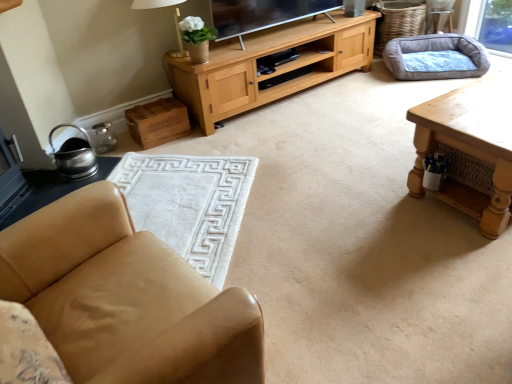
Question: Is brushed metal side table at lower left taller or shorter than white soft rug at lower left?

Choices:
 (A) short
 (B) tall

Answer: (A)

Question: Considering the positions of point (45, 193) and point (190, 236), is point (45, 193) closer or farther from the camera than point (190, 236)?

Choices:
 (A) farther
 (B) closer

Answer: (A)

Question: Which is nearer to the white fabric lampshade at upper center?

Choices:
 (A) wooden table at right
 (B) gray fabric dog bed at upper right
 (C) light brown leather armchair at upper right
 (D) white soft rug at lower left
 (E) brushed metal side table at lower left

Answer: (E)

Question: Estimate the real-world distances between objects in this image. Which object is farther from the gray fabric dog bed at upper right?

Choices:
 (A) light brown leather armchair at upper right
 (B) tan leather chair at lower left
 (C) brushed metal side table at lower left
 (D) white soft rug at lower left
 (E) wooden table at right

Answer: (B)